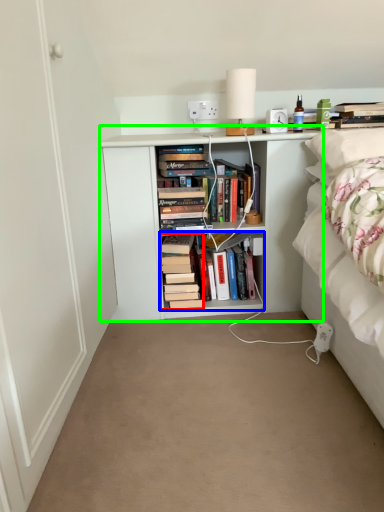
Question: Which object is the farthest from book (highlighted by a red box)? Choose among these: book (highlighted by a blue box) or shelf (highlighted by a green box).

Choices:
 (A) book
 (B) shelf

Answer: (B)